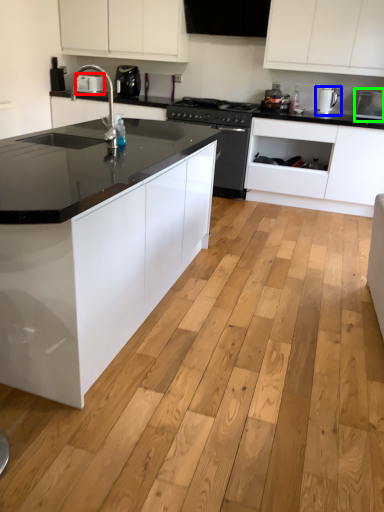
Question: Estimate the real-world distances between objects in this image. Which object is closer to appliance (highlighted by a red box), kitchen appliance (highlighted by a blue box) or appliance (highlighted by a green box)?

Choices:
 (A) kitchen appliance
 (B) appliance

Answer: (A)